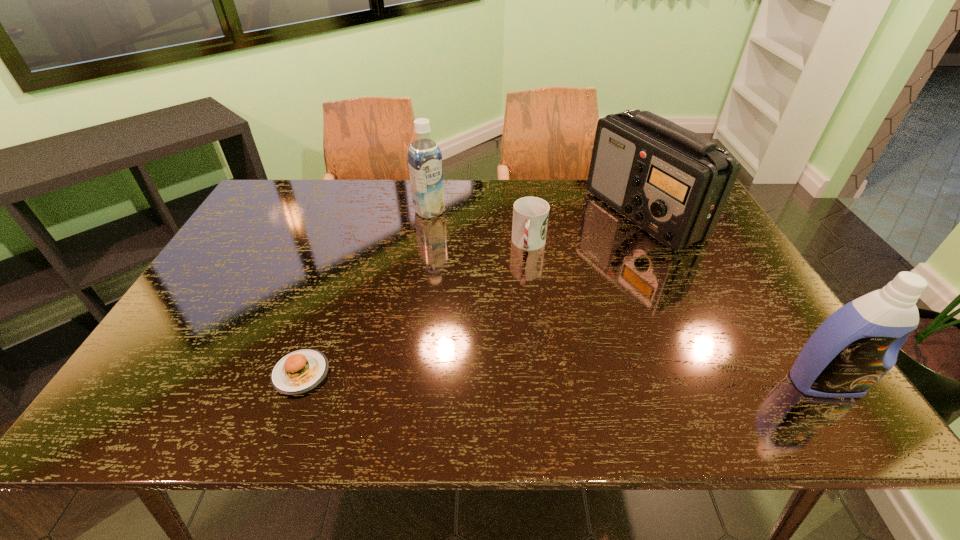
At what (x,y) coordinates should I click in order to perform the action: click on free spot at the far left corner of the desktop. Please return your answer as a coordinate pair (x, y). Looking at the image, I should click on (276, 198).

Identify the location of vacant space at the near left corner. The height and width of the screenshot is (540, 960). 165,367.

Locate an element on the screen. This screenshot has height=540, width=960. empty location between the shortest object and the detergent is located at coordinates (563, 378).

Where is `vacant area between the second object from left to right and the leftmost object`? Image resolution: width=960 pixels, height=540 pixels. vacant area between the second object from left to right and the leftmost object is located at coordinates (365, 292).

At what (x,y) coordinates should I click in order to perform the action: click on free area in between the radio receiver and the cup. Please return your answer as a coordinate pair (x, y). The image size is (960, 540). Looking at the image, I should click on click(587, 229).

Find the location of a particular element. This screenshot has height=540, width=960. vacant space that is in between the cup and the soya milk is located at coordinates (479, 228).

The image size is (960, 540). I want to click on empty space between the second object from left to right and the detergent, so click(627, 297).

The image size is (960, 540). I want to click on empty space between the detergent and the radio receiver, so click(734, 299).

Find the location of a particular element. The image size is (960, 540). free space between the food and the soya milk is located at coordinates 365,292.

The width and height of the screenshot is (960, 540). What are the coordinates of `free space between the leftmost object and the second object from left to right` in the screenshot? It's located at (365, 292).